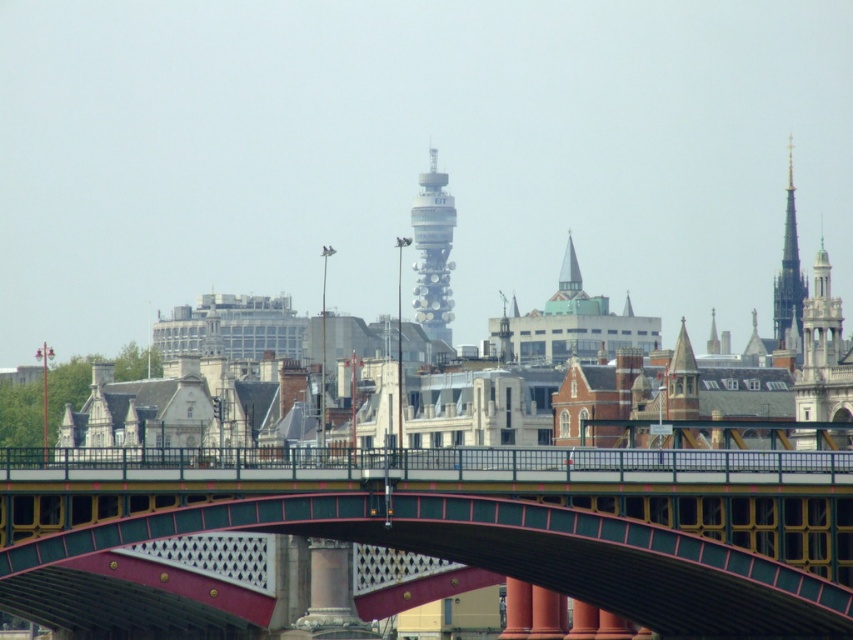
Based on the photo, you are a drone operator planning to fly a drone from the camera position to the gold textured spire at upper right. The drone has a maximum flight range of 120 meters. Can the drone reach the spire?

The gold textured spire at upper right is 121.64 meters from the camera, which exceeds the drone maximum flight range of 120 meters. Therefore, the drone cannot reach the spire.

You are a tourist standing in the city and want to take a photo that includes both the metallic red bridge at center and the golden spire at upper right. Based on their positions, which object should you frame first in your camera to ensure both are in the shot?

The metallic red bridge at center should be framed first since it is positioned on the left side of the golden spire at upper right, allowing both to be captured in the same frame.